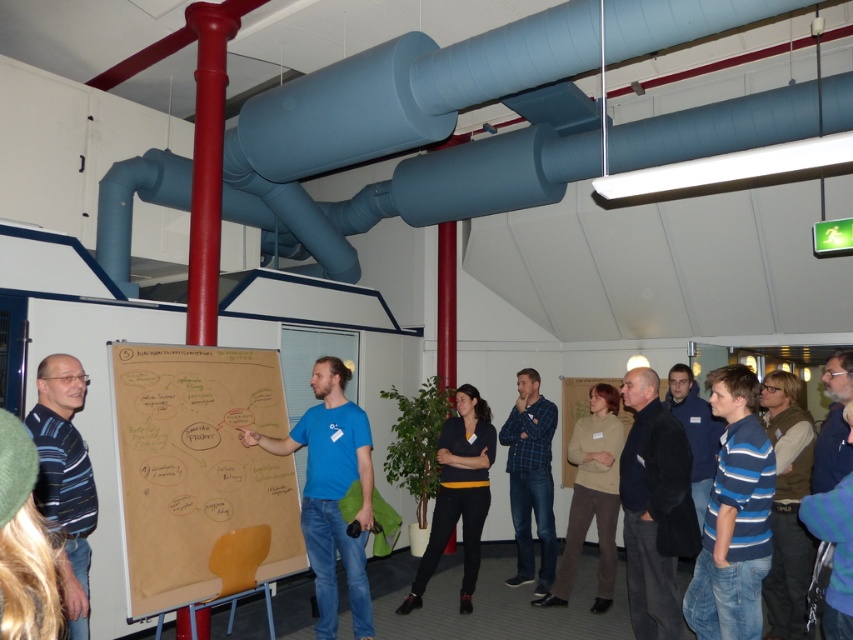
Question: Among these points, which one is farthest from the camera?

Choices:
 (A) pyautogui.click(x=460, y=424)
 (B) pyautogui.click(x=338, y=528)
 (C) pyautogui.click(x=602, y=516)
 (D) pyautogui.click(x=548, y=504)

Answer: (D)

Question: Which point is farther to the camera?

Choices:
 (A) dark blue fabric jacket at center
 (B) brown paperboard at center

Answer: (B)

Question: Does blue plaid shirt at center appear on the left side of blue striped shirt at center?

Choices:
 (A) yes
 (B) no

Answer: (A)

Question: Does blue matte shirt at center have a smaller size compared to beige sweater at center?

Choices:
 (A) no
 (B) yes

Answer: (A)

Question: Among these objects, which one is nearest to the camera?

Choices:
 (A) black matte sweater at center
 (B) blue striped shirt at center

Answer: (B)

Question: Can you confirm if brown paperboard at center is wider than striped cotton shirt at left?

Choices:
 (A) yes
 (B) no

Answer: (A)